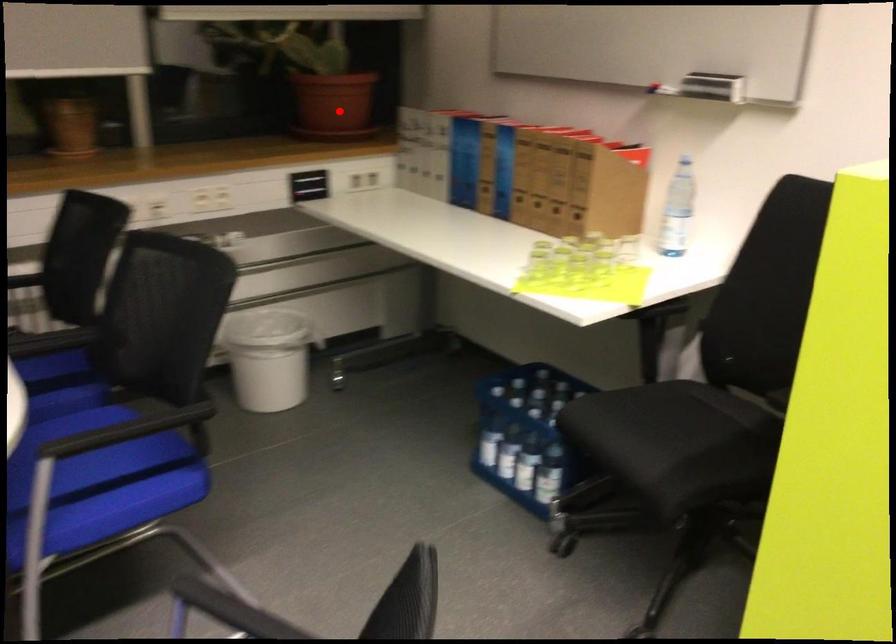
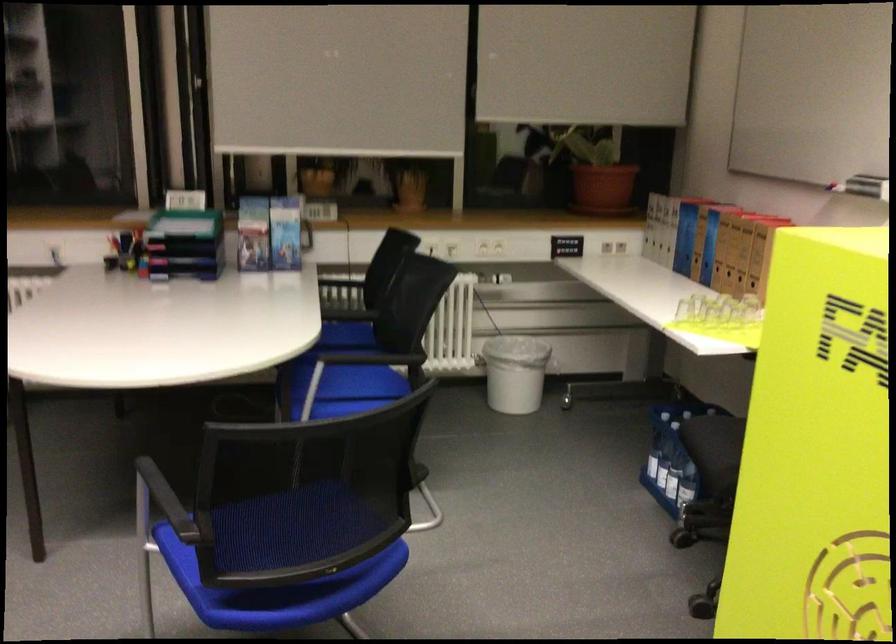
Find the pixel in the second image that matches the highlighted location in the first image.

(602, 187)